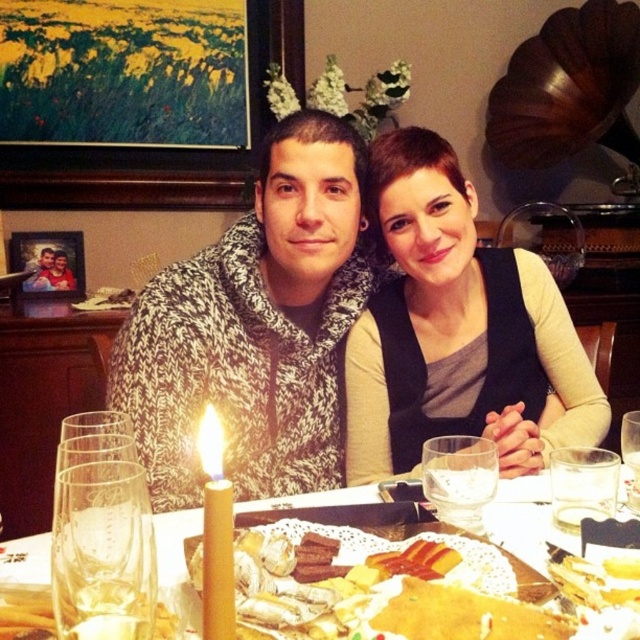
Who is higher up, matte black vest at center or translucent glass plate at center?

matte black vest at center is above.

Find the location of a particular element. matte black vest at center is located at coordinates (458, 332).

Is point (563, 413) closer to camera compared to point (38, 552)?

No, (563, 413) is behind (38, 552).

You are a GUI agent. You are given a task and a screenshot of the screen. Output one action in this format:
    pyautogui.click(x=<x>, y=<y>)
    Task: Click on the matte black vest at center
    The image size is (640, 640).
    Given the screenshot: What is the action you would take?
    pyautogui.click(x=458, y=332)

Is point (289, 65) positioned behind point (477, 436)?

That is True.

Between brushed metal picture frame at upper center and transparent glass at table center, which one appears on the right side from the viewer's perspective?

From the viewer's perspective, transparent glass at table center appears more on the right side.

This screenshot has height=640, width=640. What do you see at coordinates (163, 147) in the screenshot? I see `brushed metal picture frame at upper center` at bounding box center [163, 147].

Locate an element on the screen. The width and height of the screenshot is (640, 640). brushed metal picture frame at upper center is located at coordinates (163, 147).

Is wooden photo frame at upper left positioned behind translucent glass at lower left?

That is True.

Can you confirm if wooden photo frame at upper left is positioned above translucent glass at lower left?

Yes, wooden photo frame at upper left is above translucent glass at lower left.

Image resolution: width=640 pixels, height=640 pixels. I want to click on wooden photo frame at upper left, so click(x=49, y=262).

Where is `wooden photo frame at upper left`? This screenshot has height=640, width=640. wooden photo frame at upper left is located at coordinates (49, 262).